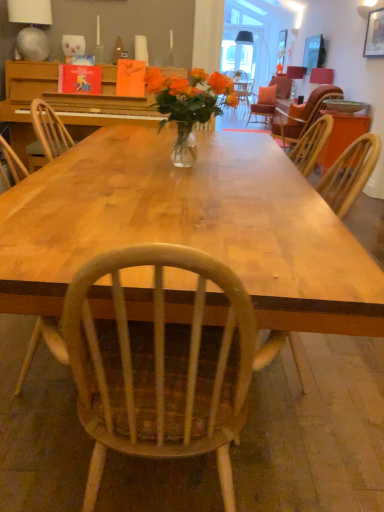
Question: From the image's perspective, is matte black lampshade at upper center, which is counted as the third lamp, starting from the left, positioned above or below translucent glass vase at center?

Choices:
 (A) below
 (B) above

Answer: (B)

Question: Considering the positions of matte black lampshade at upper center, which is the 3th lamp from front to back, and translucent glass vase at center in the image, is matte black lampshade at upper center, which is the 3th lamp from front to back, taller or shorter than translucent glass vase at center?

Choices:
 (A) tall
 (B) short

Answer: (A)

Question: Estimate the real-world distances between objects in this image. Which object is farther from the natural wood table at center?

Choices:
 (A) matte wooden frame at upper right
 (B) wooden table at right
 (C) metallic silver lampshade at upper left, which is the 3th lamp from top to bottom
 (D) translucent glass vase at center
 (E) wooden chair at right

Answer: (A)

Question: Estimate the real-world distances between objects in this image. Which object is closer to the matte pink lampshade at upper right, positioned as the second lamp in left-to-right order?

Choices:
 (A) shiny wood table at center
 (B) translucent glass vase at center
 (C) matte black lampshade at upper center, which is counted as the third lamp, starting from the left
 (D) matte wooden frame at upper right
 (E) metallic silver lampshade at upper left, which is the first lamp from bottom to top

Answer: (C)